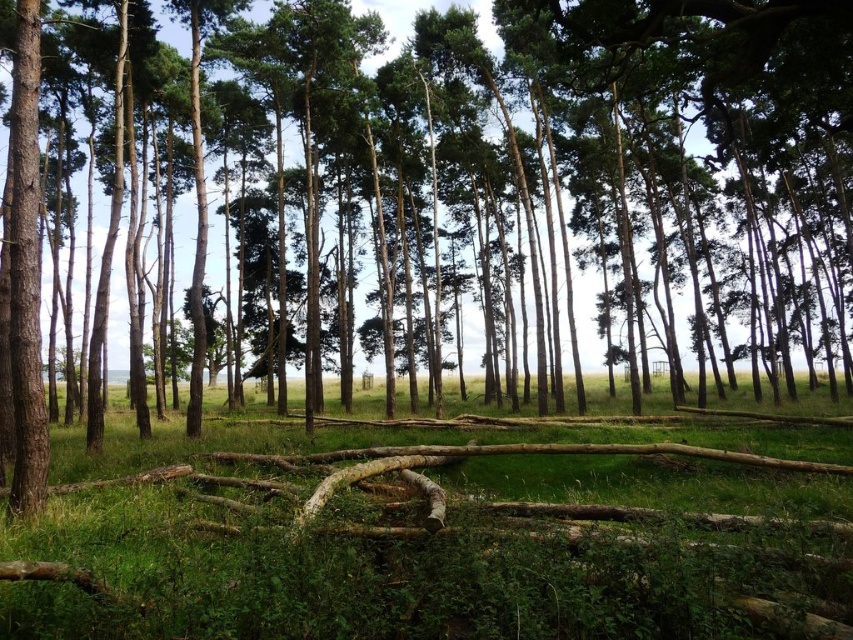
You are standing at the point marked as point (437,538) in the forest scene. What is the primary ground cover you see around you?

The point (437,538) indicates green grassy at center, so the primary ground cover around you is green grassy.

You are a hiker who wants to place a small tent on the green grassy at center. However, you need to ensure that the smooth brown tree trunk at left won

The green grassy at center is located below the smooth brown tree trunk at left, which means the tree trunk is above the grassy area. Since the trunk is part of the tree, placing the tent on the green grassy at center should be possible as it is below the tree trunk and not obstructed by it.